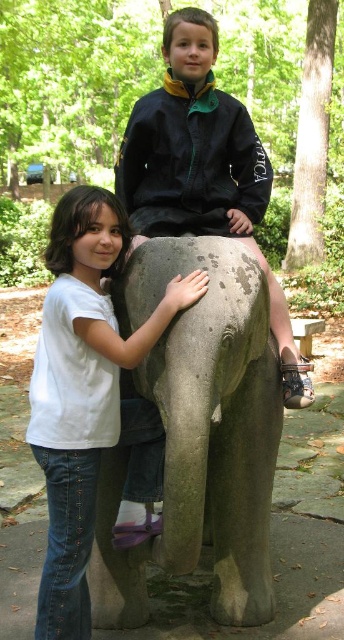
Question: Which object is farther from the camera taking this photo?

Choices:
 (A) gray matte elephant at center
 (B) dark blue jacket at upper center
 (C) white matte shirt at left

Answer: (B)

Question: Which is nearer to the dark blue jacket at upper center?

Choices:
 (A) gray matte elephant at center
 (B) white matte shirt at left

Answer: (A)

Question: Which object is closer to the camera taking this photo?

Choices:
 (A) gray matte elephant at center
 (B) dark blue jacket at upper center

Answer: (A)

Question: Can you confirm if white matte shirt at left is wider than dark blue jacket at upper center?

Choices:
 (A) no
 (B) yes

Answer: (A)

Question: Is gray matte elephant at center closer to the viewer compared to white matte shirt at left?

Choices:
 (A) yes
 (B) no

Answer: (A)

Question: From the image, what is the correct spatial relationship of white matte shirt at left in relation to dark blue jacket at upper center?

Choices:
 (A) above
 (B) below

Answer: (B)